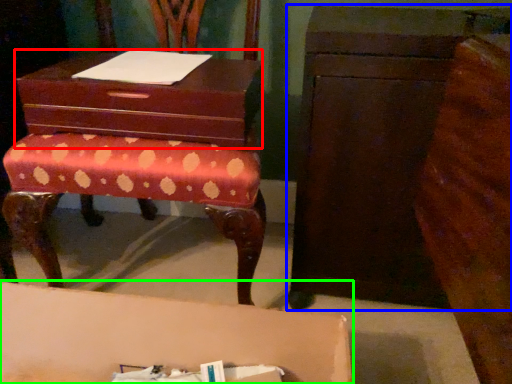
Question: Based on their relative distances, which object is nearer to storage box (highlighted by a red box)? Choose from chest of drawers (highlighted by a blue box) and table (highlighted by a green box).

Choices:
 (A) chest of drawers
 (B) table

Answer: (A)